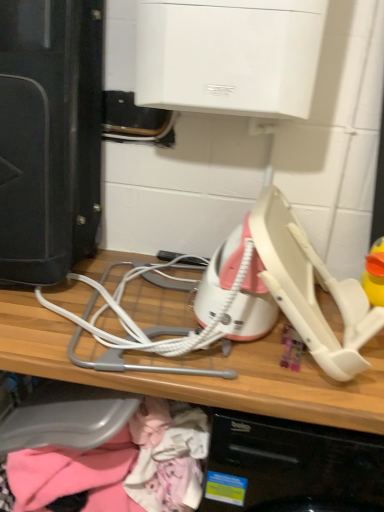
Locate an element on the screen. The width and height of the screenshot is (384, 512). empty space that is ontop of white plastic computer at center is located at coordinates (150, 317).